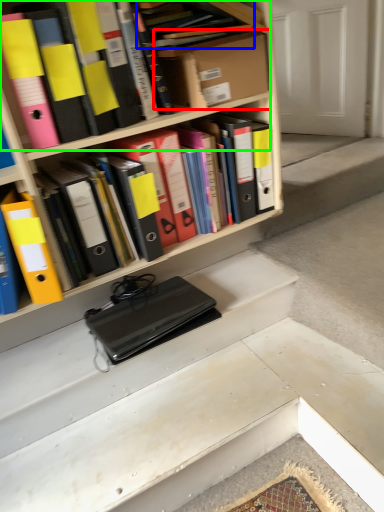
Question: Estimate the real-world distances between objects in this image. Which object is farther from cardboard box (highlighted by a red box), book (highlighted by a blue box) or book (highlighted by a green box)?

Choices:
 (A) book
 (B) book

Answer: (A)